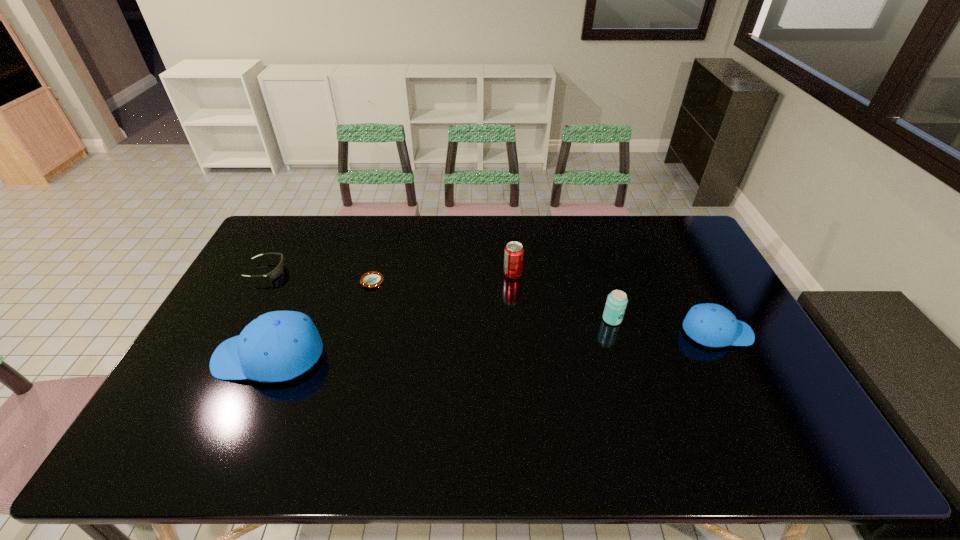
Where is `free location at the left edge`? Image resolution: width=960 pixels, height=540 pixels. free location at the left edge is located at coordinates (274, 262).

The width and height of the screenshot is (960, 540). I want to click on vacant space at the far right corner of the desktop, so click(x=694, y=237).

At what (x,y) coordinates should I click in order to perform the action: click on vacant space at the near right corner of the desktop. Please return your answer as a coordinate pair (x, y). The image size is (960, 540). Looking at the image, I should click on (781, 408).

The image size is (960, 540). In order to click on free space between the tallest object and the shortest object in this screenshot , I will do pos(321,319).

I want to click on free spot between the fifth shortest object and the fifth tallest object, so click(x=390, y=273).

Find the location of a particular element. This screenshot has height=540, width=960. free area in between the goggles and the rightmost object is located at coordinates (492, 301).

Find the location of a particular element. The height and width of the screenshot is (540, 960). vacant region between the beer can and the right cap is located at coordinates (664, 326).

Identify the location of free space between the beer can and the fifth tallest object. (440, 295).

Image resolution: width=960 pixels, height=540 pixels. What are the coordinates of `vacant space that is in between the right cap and the compass` in the screenshot? It's located at (544, 307).

I want to click on free spot between the shorter cap and the compass, so click(x=544, y=307).